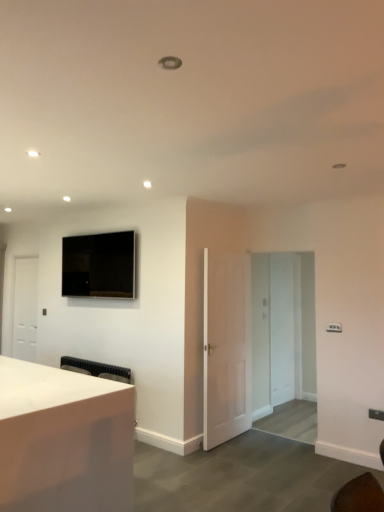
What do you see at coordinates (282, 327) in the screenshot?
I see `transparent glass door at center` at bounding box center [282, 327].

Image resolution: width=384 pixels, height=512 pixels. What are the coordinates of `transparent glass door at center` in the screenshot? It's located at (282, 327).

Find the location of a particular element. This screenshot has width=384, height=512. white glossy desk at lower left is located at coordinates (64, 440).

From the image's perspective, relative to white matte door at left, the 2th door from the front, is white matte door at center, which appears as the 1th door when viewed from the right, above or below?

white matte door at center, which appears as the 1th door when viewed from the right, is situated lower than white matte door at left, the 2th door from the front, in the image.

Considering the positions of points (238, 369) and (18, 325), is point (238, 369) farther from camera compared to point (18, 325)?

No, (238, 369) is in front of (18, 325).

Consider the image. Visually, is white matte door at center, which appears as the 1th door when viewed from the right, positioned to the left or to the right of white matte door at left, the 1th door positioned from the left?

white matte door at center, which appears as the 1th door when viewed from the right, is positioned on white matte door at left, the 1th door positioned from the left,'s right side.

Is the position of white matte door at center, which is the 1th door in front-to-back order, more distant than that of white matte door at left, the 2th door from the front?

No, it is not.

From a real-world perspective, which object rests below the other?

From a 3D spatial view, white glossy desk at lower left is below.

Where is `desk in front of the matte black tv at upper left`? This screenshot has height=512, width=384. desk in front of the matte black tv at upper left is located at coordinates (64, 440).

Can you confirm if matte black tv at upper left is positioned to the right of white glossy desk at lower left?

Indeed, matte black tv at upper left is positioned on the right side of white glossy desk at lower left.

Which is closer to the camera, (115, 242) or (91, 485)?

Point (115, 242) is positioned farther from the camera compared to point (91, 485).

From a real-world perspective, is white matte door at center, which appears as the 1th door when viewed from the right, on transparent glass door at center?

No, from a real-world perspective, white matte door at center, which appears as the 1th door when viewed from the right, is not on top of transparent glass door at center.

Is white matte door at center, which appears as the 1th door when viewed from the right, in front of or behind transparent glass door at center in the image?

In the image, white matte door at center, which appears as the 1th door when viewed from the right, appears in front of transparent glass door at center.

Is white matte door at center, which appears as the 1th door when viewed from the right, looking in the opposite direction of transparent glass door at center?

white matte door at center, which appears as the 1th door when viewed from the right, does not have its back to transparent glass door at center.

Considering the sizes of white matte door at left, which appears as the 2th door when viewed from the right, and matte black tv at upper left in the image, is white matte door at left, which appears as the 2th door when viewed from the right, bigger or smaller than matte black tv at upper left?

white matte door at left, which appears as the 2th door when viewed from the right, is bigger than matte black tv at upper left.

From a real-world perspective, between white matte door at left, the 2th door from the front, and matte black tv at upper left, who is vertically higher?

matte black tv at upper left is physically above.

Is white matte door at left, the first door when ordered from back to front, aimed at matte black tv at upper left?

No, white matte door at left, the first door when ordered from back to front, does not turn towards matte black tv at upper left.

The width and height of the screenshot is (384, 512). I want to click on door that is behind the matte black tv at upper left, so click(x=25, y=309).

Is matte black tv at upper left directly adjacent to transparent glass door at center?

No, matte black tv at upper left is not beside transparent glass door at center.

Which of these two, matte black tv at upper left or transparent glass door at center, is thinner?

transparent glass door at center.

Is matte black tv at upper left to the left of transparent glass door at center from the viewer's perspective?

Correct, you'll find matte black tv at upper left to the left of transparent glass door at center.

Which is more distant, [278,385] or [215,342]?

The point [278,385] is behind.

Is transparent glass door at center positioned before white matte door at center, which appears as the 1th door when viewed from the right?

No, transparent glass door at center is further to the viewer.

Considering the relative positions of transparent glass door at center and white matte door at center, which is the 2th door from left to right, in the image provided, is transparent glass door at center to the left of white matte door at center, which is the 2th door from left to right, from the viewer's perspective?

No, transparent glass door at center is not to the left of white matte door at center, which is the 2th door from left to right.

Is transparent glass door at center oriented away from white matte door at center, which is the 2th door from left to right?

No, transparent glass door at center is not facing away from white matte door at center, which is the 2th door from left to right.

From the picture: From the image's perspective, is matte black tv at upper left on white matte door at center, which appears as the 1th door when viewed from the right?

Yes, from the image's perspective, matte black tv at upper left is above white matte door at center, which appears as the 1th door when viewed from the right.

Between matte black tv at upper left and white matte door at center, which is the 2th door from left to right, which one has larger size?

With larger size is white matte door at center, which is the 2th door from left to right.

Which of these two, matte black tv at upper left or white matte door at center, the 2th door positioned from the back, is wider?

matte black tv at upper left is wider.

Is matte black tv at upper left inside the boundaries of white matte door at center, the 2th door positioned from the back, or outside?

matte black tv at upper left lies outside white matte door at center, the 2th door positioned from the back.

Identify the location of door behind the white matte door at center, which is the 1th door in front-to-back order. The width and height of the screenshot is (384, 512). (25, 309).

At what (x,y) coordinates should I click in order to perform the action: click on desk below the matte black tv at upper left (from the image's perspective). Please return your answer as a coordinate pair (x, y). The height and width of the screenshot is (512, 384). Looking at the image, I should click on (64, 440).

Looking at the image, which one is located closer to matte black tv at upper left, white glossy desk at lower left or white matte door at center, which appears as the 1th door when viewed from the right?

white matte door at center, which appears as the 1th door when viewed from the right.

Which object lies nearer to the anchor point transparent glass door at center, white matte door at left, the 2th door from the front, or white matte door at center, which is the 1th door in front-to-back order?

white matte door at center, which is the 1th door in front-to-back order, is positioned closer to the anchor transparent glass door at center.

Estimate the real-world distances between objects in this image. Which object is further from transparent glass door at center, white glossy desk at lower left or white matte door at left, the 1th door positioned from the left?

white matte door at left, the 1th door positioned from the left, lies further to transparent glass door at center than the other object.

Estimate the real-world distances between objects in this image. Which object is further from white matte door at center, the 2th door positioned from the back, white glossy desk at lower left or transparent glass door at center?

white glossy desk at lower left is further to white matte door at center, the 2th door positioned from the back.

Estimate the real-world distances between objects in this image. Which object is further from transparent glass door at center, white glossy desk at lower left or white matte door at center, which is the 2th door from left to right?

white glossy desk at lower left is further to transparent glass door at center.

Based on their spatial positions, is white matte door at center, which appears as the 1th door when viewed from the right, or transparent glass door at center closer to matte black tv at upper left?

Based on the image, white matte door at center, which appears as the 1th door when viewed from the right, appears to be nearer to matte black tv at upper left.

Considering their positions, is white matte door at left, the first door when ordered from back to front, positioned closer to matte black tv at upper left than white matte door at center, which is the 2th door from left to right?

white matte door at left, the first door when ordered from back to front.

Looking at the image, which one is located further to white matte door at center, which appears as the 1th door when viewed from the right, white glossy desk at lower left or matte black tv at upper left?

Among the two, white glossy desk at lower left is located further to white matte door at center, which appears as the 1th door when viewed from the right.

Where is `television between white matte door at left, the 1th door positioned from the left, and transparent glass door at center, in the horizontal direction`? This screenshot has height=512, width=384. television between white matte door at left, the 1th door positioned from the left, and transparent glass door at center, in the horizontal direction is located at coordinates (99, 265).

I want to click on door situated between matte black tv at upper left and transparent glass door at center from left to right, so point(226,347).

Locate an element on the screen. glass door positioned between white glossy desk at lower left and white matte door at left, the 2th door from the front, from near to far is located at coordinates (282, 327).

Find the location of a particular element. door between white matte door at left, which appears as the 2th door when viewed from the right, and transparent glass door at center is located at coordinates (226, 347).